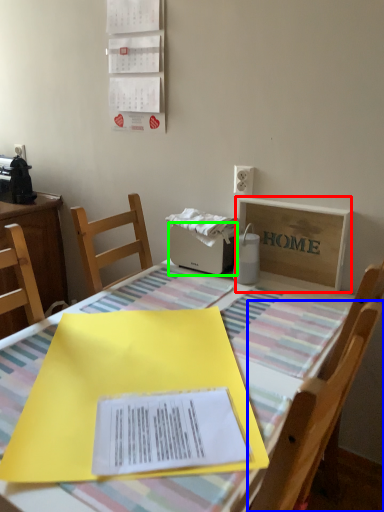
Question: Based on their relative distances, which object is farther from cardboard box (highlighted by a red box)? Choose from chair (highlighted by a blue box) and appliance (highlighted by a green box).

Choices:
 (A) chair
 (B) appliance

Answer: (A)